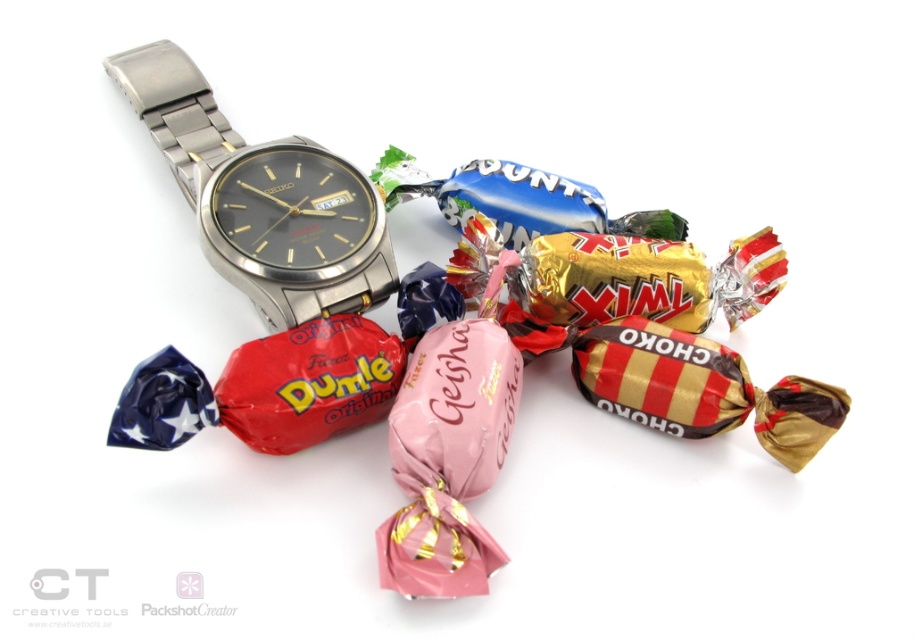
Is satin silver watch at upper left further to camera compared to metallic watch at center?

No, satin silver watch at upper left is closer to the viewer.

Is satin silver watch at upper left to the left of metallic watch at center from the viewer's perspective?

Yes, satin silver watch at upper left is to the left of metallic watch at center.

Does point (359, 204) come farther from viewer compared to point (328, 188)?

No, it is not.

This screenshot has height=640, width=914. What are the coordinates of `satin silver watch at upper left` in the screenshot? It's located at (261, 198).